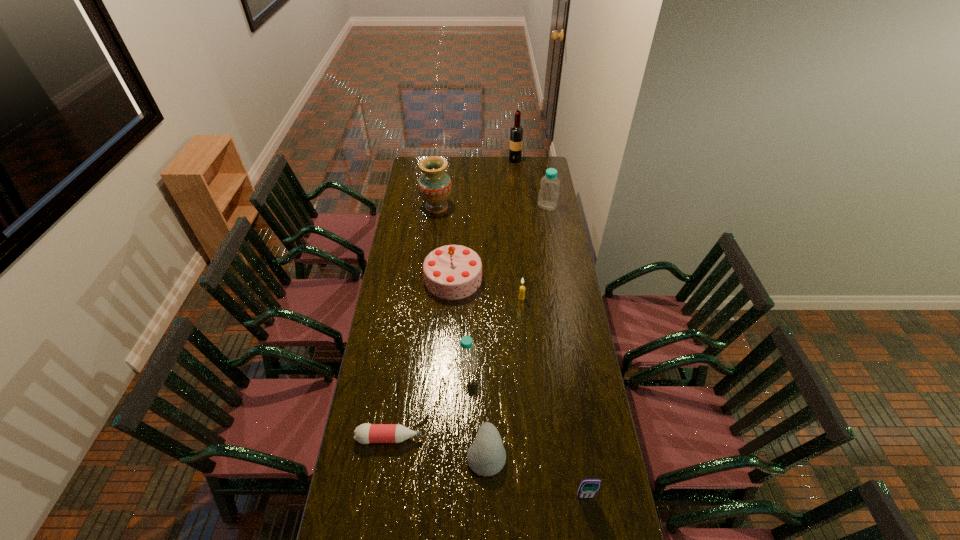
You are a GUI agent. You are given a task and a screenshot of the screen. Output one action in this format:
    pyautogui.click(x=<x>, y=<y>)
    Task: Click on the empty space that is in between the cream candle and the nearer blue bottle
    This screenshot has height=540, width=960.
    Given the screenshot: What is the action you would take?
    pyautogui.click(x=494, y=332)

The width and height of the screenshot is (960, 540). Identify the location of vacant area that lies between the gray beanie and the cream candle. (504, 375).

Find the location of a particular element. free space that is in between the cream candle and the farthest object is located at coordinates (518, 229).

The height and width of the screenshot is (540, 960). In order to click on free space between the second tallest object and the cellular telephone in this screenshot , I will do `click(511, 352)`.

I want to click on free space between the eighth shortest object and the bigger blue bottle, so click(492, 207).

Find the location of a particular element. vacant region between the cellular telephone and the birthday cake is located at coordinates click(x=519, y=388).

Where is `vacant region between the cream candle and the second bottle from right to left`? vacant region between the cream candle and the second bottle from right to left is located at coordinates tap(494, 332).

Where is `free spot between the nearest object and the vase`? free spot between the nearest object and the vase is located at coordinates (511, 352).

The image size is (960, 540). What are the coordinates of `vacant area that lies between the second shortest bottle and the wine bottle` in the screenshot? It's located at (492, 263).

I want to click on free space between the cellular telephone and the wine bottle, so click(x=550, y=329).